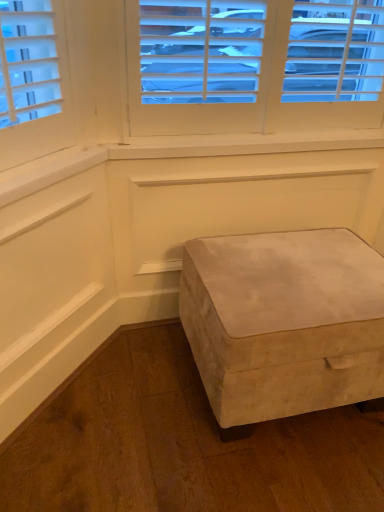
This screenshot has width=384, height=512. What do you see at coordinates (284, 322) in the screenshot?
I see `beige suede ottoman at lower right` at bounding box center [284, 322].

The height and width of the screenshot is (512, 384). Find the location of `beige suede ottoman at lower right`. beige suede ottoman at lower right is located at coordinates (284, 322).

Identify the location of beige suede ottoman at lower right. (284, 322).